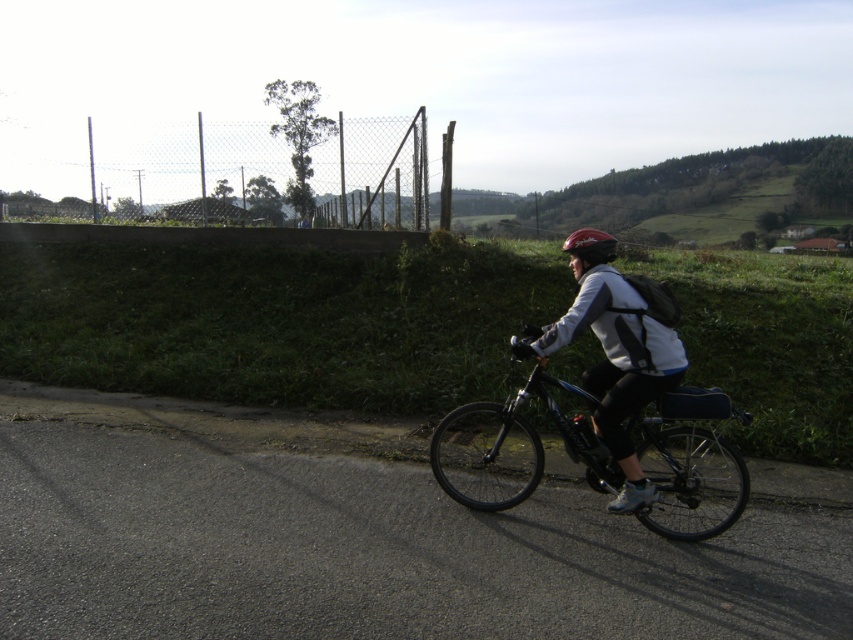
You are standing on the side of the road and want to cross to the other side. The shiny blue bicycle at center is approaching you. If you start walking directly towards the opposite side when the bicycle is 4.65 meters away, will you have enough time to cross safely? Assume you walk at 1.5 meters per second and the bicycle is moving at 5 meters per second.

The shiny blue bicycle at center is 4.65 meters away from you. Since the bicycle is moving at 5 mps and you walk at 1.5 mps, the time until the bicycle reaches you is 4.65 meters divided by 5 mps, which equals 0.93 seconds. You need to cross the road, but with only 0.93 seconds, you can only cover 1.395 meters, which is insufficient to cross safely. Therefore, you should wait for the bicycle to pass before attempting to cross.

You are a delivery person who needs to attach a GPS tracker to the shiny blue bicycle at center. The GPS tracker must be placed at the point with coordinates point (602, 419). Where exactly on the shiny blue bicycle at center should you place the GPS tracker?

The point (602, 419) corresponds to the shiny blue bicycle at center, so you should place the GPS tracker there.